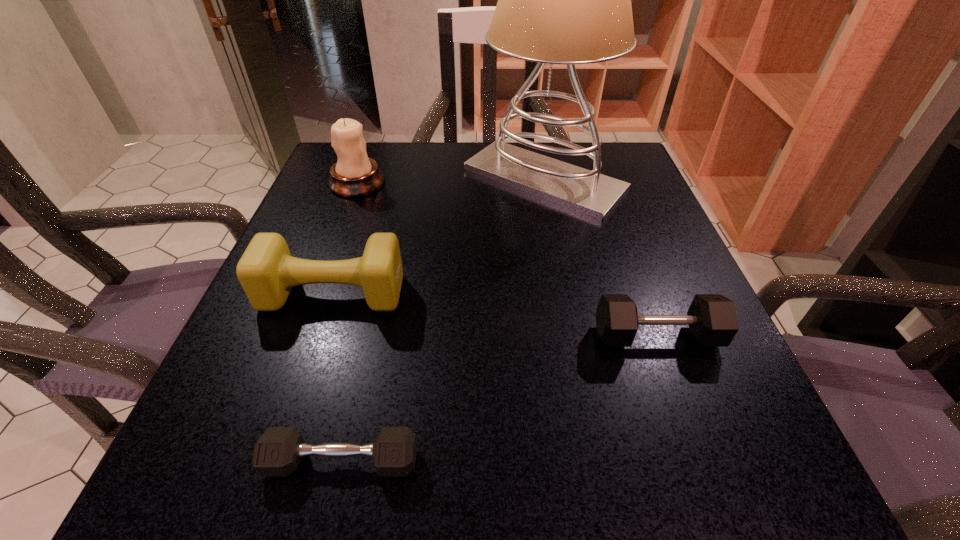
Where is `vacant area that satisfies the following two spatial constraints: 1. on the back side of the second shortest dumbbell; 2. on the right side of the nearest object`? vacant area that satisfies the following two spatial constraints: 1. on the back side of the second shortest dumbbell; 2. on the right side of the nearest object is located at coordinates (370, 337).

In order to click on free space that satisfies the following two spatial constraints: 1. on the front side of the nearest object; 2. on the left side of the third shortest object in this screenshot , I will do `click(277, 461)`.

Identify the location of free space that satisfies the following two spatial constraints: 1. on the front side of the candle holder; 2. on the left side of the third farthest object. (317, 293).

Image resolution: width=960 pixels, height=540 pixels. Find the location of `free location that satisfies the following two spatial constraints: 1. on the front side of the second tallest object; 2. on the right side of the second shortest dumbbell`. free location that satisfies the following two spatial constraints: 1. on the front side of the second tallest object; 2. on the right side of the second shortest dumbbell is located at coordinates (300, 337).

Locate an element on the screen. free location that satisfies the following two spatial constraints: 1. on the back side of the tallest object; 2. on the left side of the nearest dumbbell is located at coordinates (405, 179).